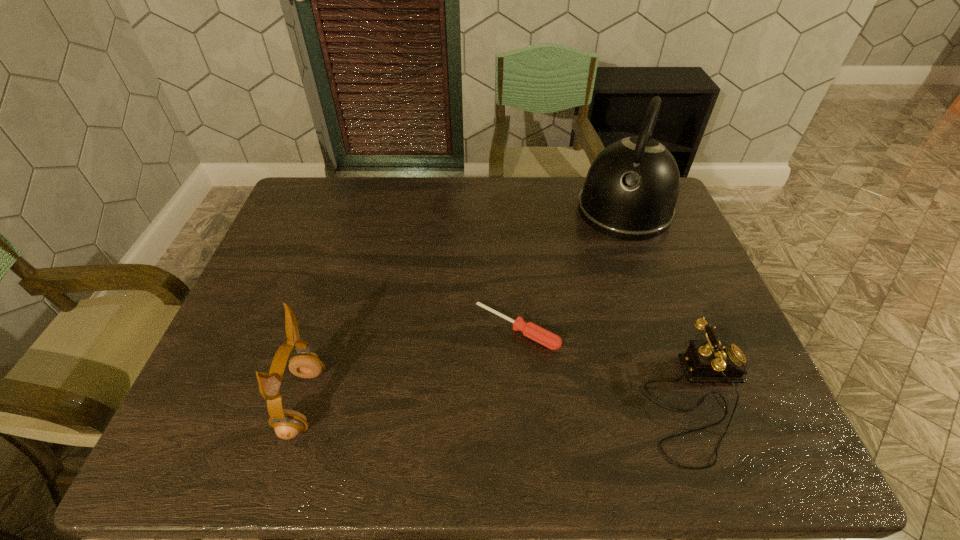
The image size is (960, 540). What are the coordinates of `free point between the screwdriver and the second tallest object` in the screenshot? It's located at coord(410,365).

The image size is (960, 540). Find the location of `empty space between the leftmost object and the telephone`. empty space between the leftmost object and the telephone is located at coordinates (501, 402).

Locate an element on the screen. This screenshot has width=960, height=540. free area in between the earphone and the farthest object is located at coordinates (464, 306).

Where is `empty space between the leftmost object and the tallest object`? The width and height of the screenshot is (960, 540). empty space between the leftmost object and the tallest object is located at coordinates (464, 306).

This screenshot has height=540, width=960. I want to click on free space between the third shortest object and the shortest object, so click(410, 365).

At what (x,y) coordinates should I click in order to perform the action: click on vacant space that is in between the screwdriver and the telephone. Please return your answer as a coordinate pair (x, y). Looking at the image, I should click on (608, 365).

Locate an element on the screen. Image resolution: width=960 pixels, height=540 pixels. free space between the shortest object and the second shortest object is located at coordinates (608, 365).

Point out which object is positioned as the third nearest to the second object from left to right. Please provide its 2D coordinates. Your answer should be formatted as a tuple, i.e. [(x, y)], where the tuple contains the x and y coordinates of a point satisfying the conditions above.

[(287, 424)]

Locate which object is the third closest to the shortest object. Please provide its 2D coordinates. Your answer should be formatted as a tuple, i.e. [(x, y)], where the tuple contains the x and y coordinates of a point satisfying the conditions above.

[(287, 424)]

I want to click on free spot that satisfies the following two spatial constraints: 1. on the front side of the second shortest object; 2. on the dial of the screwdriver, so click(522, 402).